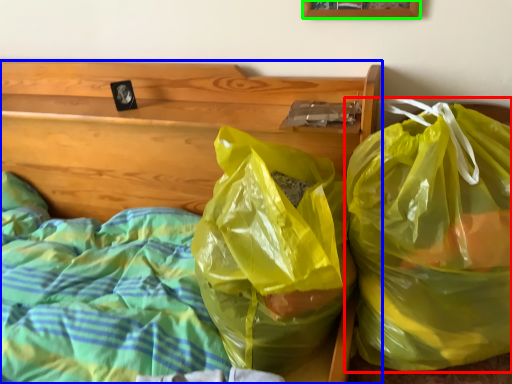
Question: Which object is the closest to the plastic bag (highlighted by a red box)? Choose among these: furniture (highlighted by a blue box) or picture frame (highlighted by a green box).

Choices:
 (A) furniture
 (B) picture frame

Answer: (A)